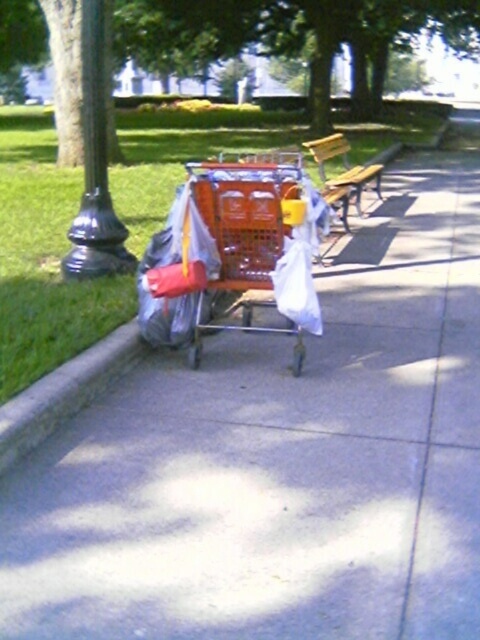
You are a person trying to sit on the wooden bench at center. Is there enough space to sit there without moving the orange plastic shopping cart at center?

The orange plastic shopping cart at center is positioned under wooden bench at center, so the cart is occupying the space under the bench. Therefore, there is no space left to sit on the wooden bench at center without moving the cart.

Looking at this image, you are standing at the origin point in the park. The orange plastic shopping cart at center is at coordinates 0.369 on the x and 0.515 on the y. If you want to walk directly to the cart, in which general direction should you head?

The orange plastic shopping cart at center is located at coordinates x 0.369 and y 0.515. Since you are at the origin, you should move northeast to reach it, as both x and y values are positive and greater than zero.

You are trying to determine if the orange plastic shopping cart at center can fit under a low ceiling in a storage room that is the same height as the wooden bench at center. Based on their heights, will the cart fit?

The orange plastic shopping cart at center is much taller than the wooden bench at center, so it will not fit under the ceiling that matches the bench height.